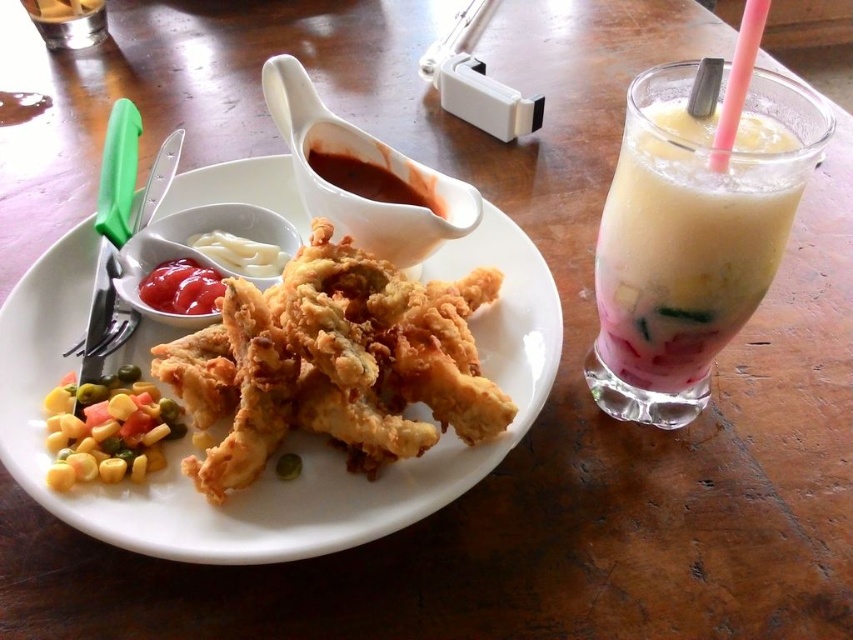
Is point (108, 390) less distant than point (273, 244)?

Yes, point (108, 390) is closer to viewer.

Who is higher up, yellow-green corn kernels at center-left or white creamy sauce at center?

white creamy sauce at center is above.

Who is more forward, [131,412] or [259,262]?

Point [131,412] is in front.

At what (x,y) coordinates should I click in order to perform the action: click on yellow-green corn kernels at center-left. Please return your answer as a coordinate pair (x, y). Looking at the image, I should click on (108, 429).

Which is below, golden crispy fried chicken at center or milky smooth drink at right?

Positioned lower is golden crispy fried chicken at center.

Is golden crispy fried chicken at center above milky smooth drink at right?

No.

You are a GUI agent. You are given a task and a screenshot of the screen. Output one action in this format:
    pyautogui.click(x=<x>, y=<y>)
    Task: Click on the golden crispy fried chicken at center
    The height and width of the screenshot is (640, 853).
    Given the screenshot: What is the action you would take?
    pyautogui.click(x=334, y=364)

Image resolution: width=853 pixels, height=640 pixels. What are the coordinates of `golden crispy fried chicken at center` in the screenshot? It's located at [x=334, y=364].

You are a GUI agent. You are given a task and a screenshot of the screen. Output one action in this format:
    pyautogui.click(x=<x>, y=<y>)
    Task: Click on the golden fried chicken at center
    Image resolution: width=853 pixels, height=640 pixels.
    Given the screenshot: What is the action you would take?
    pyautogui.click(x=289, y=435)

Describe the element at coordinates (289, 435) in the screenshot. I see `golden fried chicken at center` at that location.

I want to click on golden fried chicken at center, so click(x=289, y=435).